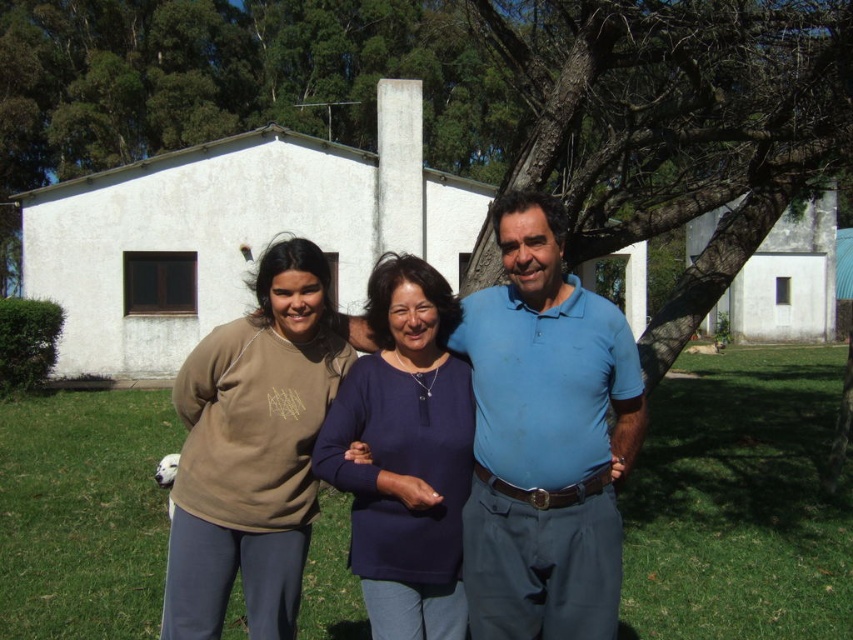
Who is shorter, matte brown sweatshirt at center or navy blue sweater at center?

navy blue sweater at center is shorter.

Can you confirm if matte brown sweatshirt at center is positioned to the right of navy blue sweater at center?

Incorrect, matte brown sweatshirt at center is not on the right side of navy blue sweater at center.

Image resolution: width=853 pixels, height=640 pixels. Describe the element at coordinates (252, 451) in the screenshot. I see `matte brown sweatshirt at center` at that location.

Find the location of a particular element. matte brown sweatshirt at center is located at coordinates (252, 451).

Which is more to the right, matte brown sweater at center or matte brown sweatshirt at center?

matte brown sweater at center is more to the right.

This screenshot has width=853, height=640. In order to click on matte brown sweater at center in this screenshot , I will do `click(544, 436)`.

This screenshot has width=853, height=640. I want to click on matte brown sweater at center, so click(x=544, y=436).

You are a GUI agent. You are given a task and a screenshot of the screen. Output one action in this format:
    pyautogui.click(x=<x>, y=<y>)
    Task: Click on the matte brown sweater at center
    This screenshot has height=640, width=853.
    Given the screenshot: What is the action you would take?
    pyautogui.click(x=544, y=436)

Is point (498, 400) positioned in front of point (415, 317)?

That is True.

Image resolution: width=853 pixels, height=640 pixels. I want to click on matte brown sweater at center, so click(x=544, y=436).